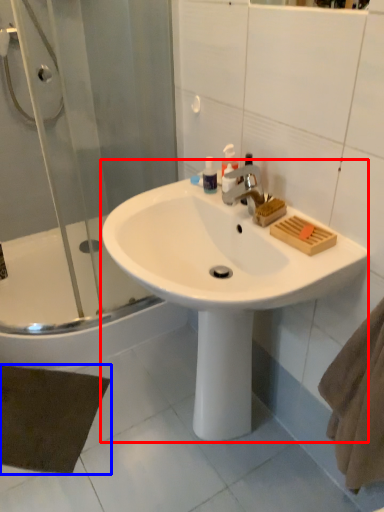
Question: Which of the following is the farthest to the observer, sink (highlighted by a red box) or bath mat (highlighted by a blue box)?

Choices:
 (A) sink
 (B) bath mat

Answer: (B)